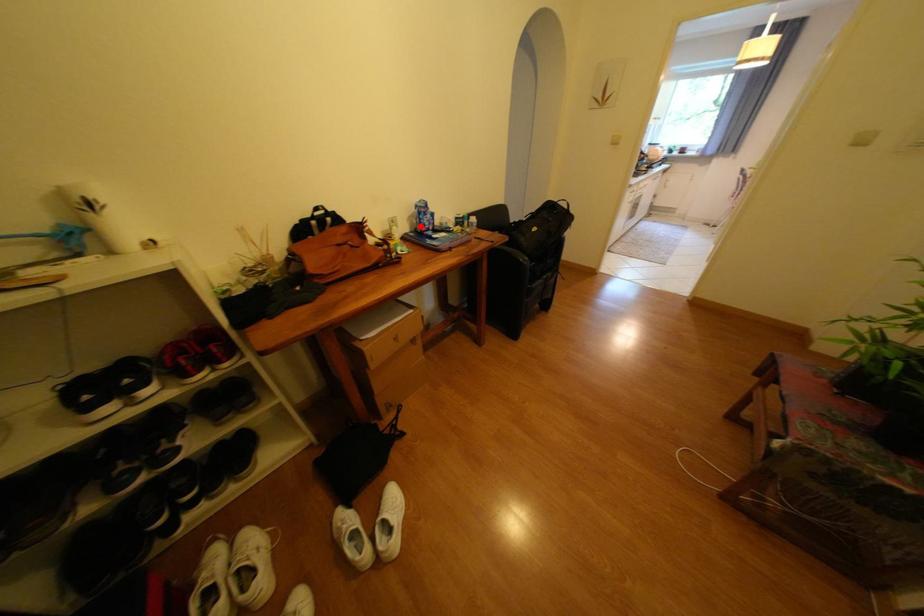
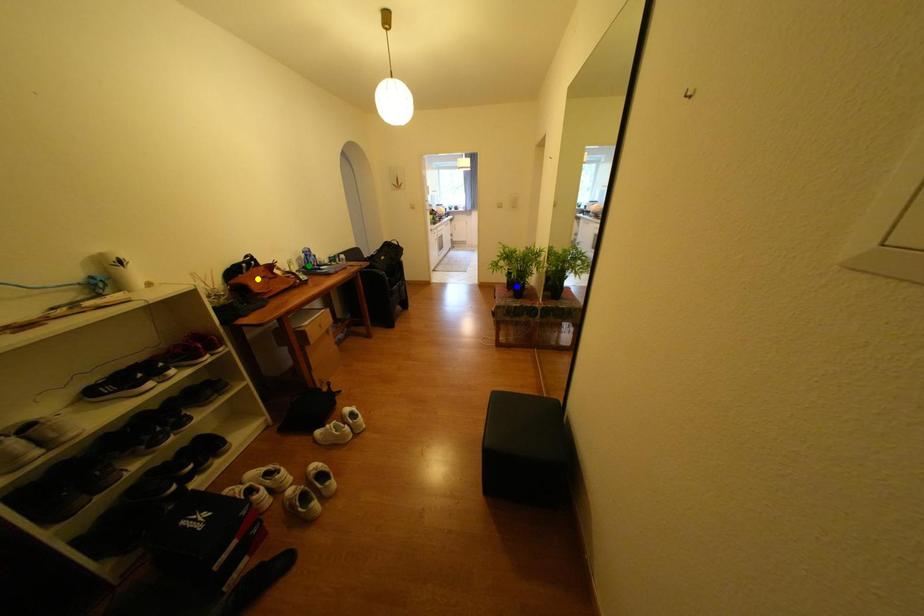
Question: I am providing you with two images of the same scene from different viewpoints. A red point is marked on the first image. You are given multiple points on the second image. Can you choose the point in image 2 that corresponds to the point in image 1?

Choices:
 (A) green point
 (B) yellow point
 (C) blue point

Answer: (A)